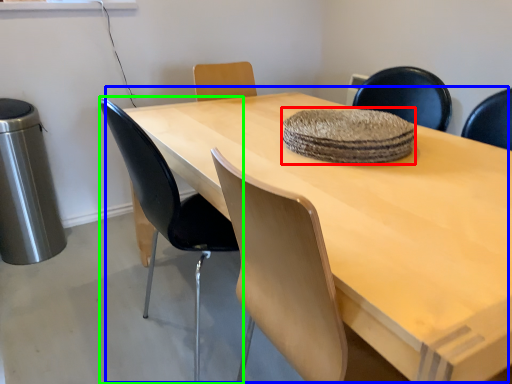
Question: Which is nearer to the mat (highlighted by a red box)? table (highlighted by a blue box) or chair (highlighted by a green box).

Choices:
 (A) table
 (B) chair

Answer: (A)